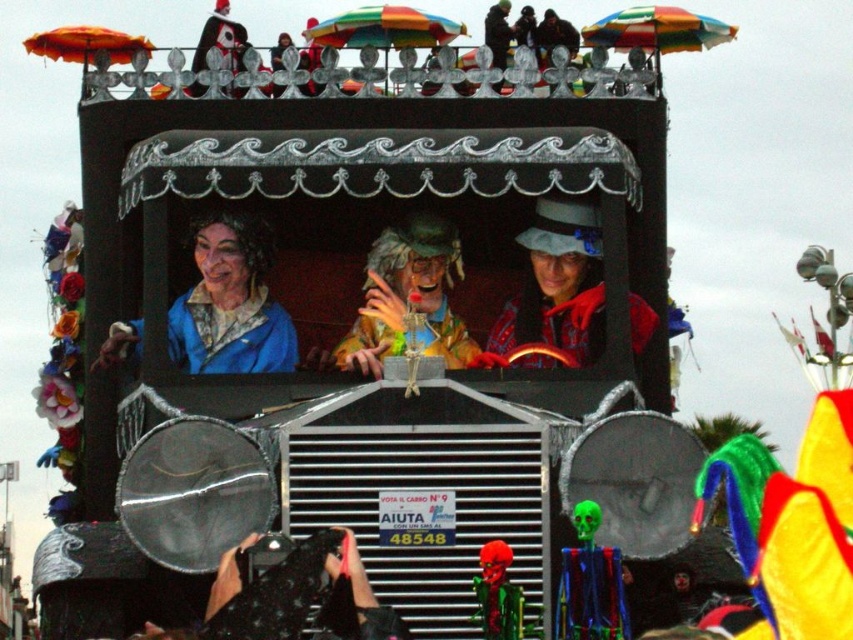
Question: Considering the relative positions of shiny green skull at lower center and brown leather jacket at center in the image provided, where is shiny green skull at lower center located with respect to brown leather jacket at center?

Choices:
 (A) right
 (B) left

Answer: (B)

Question: Which of these objects is positioned farthest from the brown leather jacket at center?

Choices:
 (A) matte blue coat at center
 (B) dark brown leather jacket at upper center

Answer: (A)

Question: Which point is closer to the camera?

Choices:
 (A) dark brown leather jacket at upper center
 (B) matte blue coat at center
 (C) matte yellow costume at center

Answer: (C)

Question: Considering the real-world distances, which object is closest to the matte yellow costume at center?

Choices:
 (A) matte blue coat at center
 (B) red fabric hat at center
 (C) shiny green skull at lower center
 (D) brown leather jacket at center

Answer: (B)

Question: Is matte yellow costume at center thinner than brown leather jacket at center?

Choices:
 (A) no
 (B) yes

Answer: (A)

Question: Does shiny green skull at lower center lie in front of brown leather jacket at center?

Choices:
 (A) yes
 (B) no

Answer: (A)